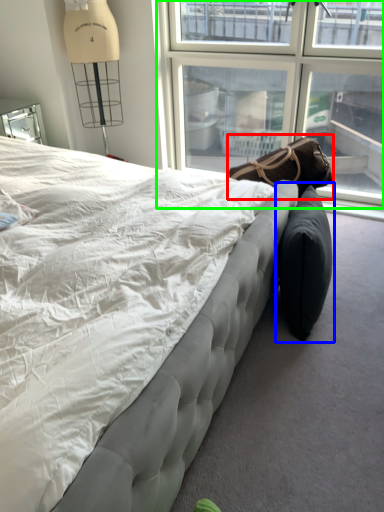
Question: Which object is positioned closest to bean bag chair (highlighted by a red box)? Select from bean bag chair (highlighted by a blue box) and window (highlighted by a green box).

Choices:
 (A) bean bag chair
 (B) window

Answer: (A)